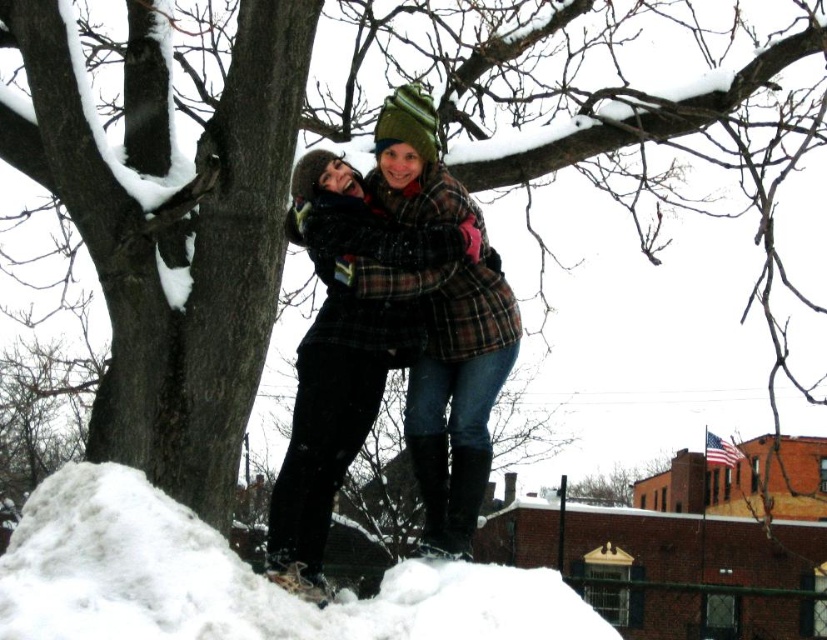
Can you confirm if white fluffy snow at lower left is positioned above plaid wool coat at center?

No, white fluffy snow at lower left is not above plaid wool coat at center.

You are a GUI agent. You are given a task and a screenshot of the screen. Output one action in this format:
    pyautogui.click(x=<x>, y=<y>)
    Task: Click on the white fluffy snow at lower left
    
    Given the screenshot: What is the action you would take?
    pyautogui.click(x=237, y=580)